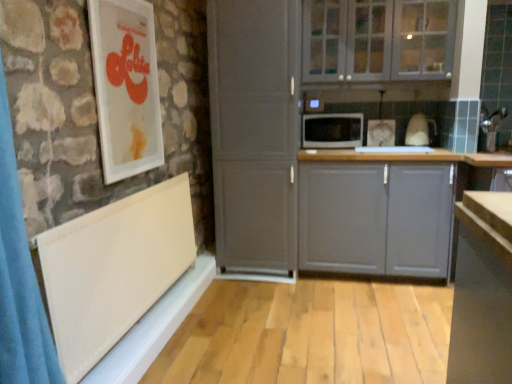
Identify the location of free spot below white glossy picture frame at upper left (from a real-world perspective). (134, 187).